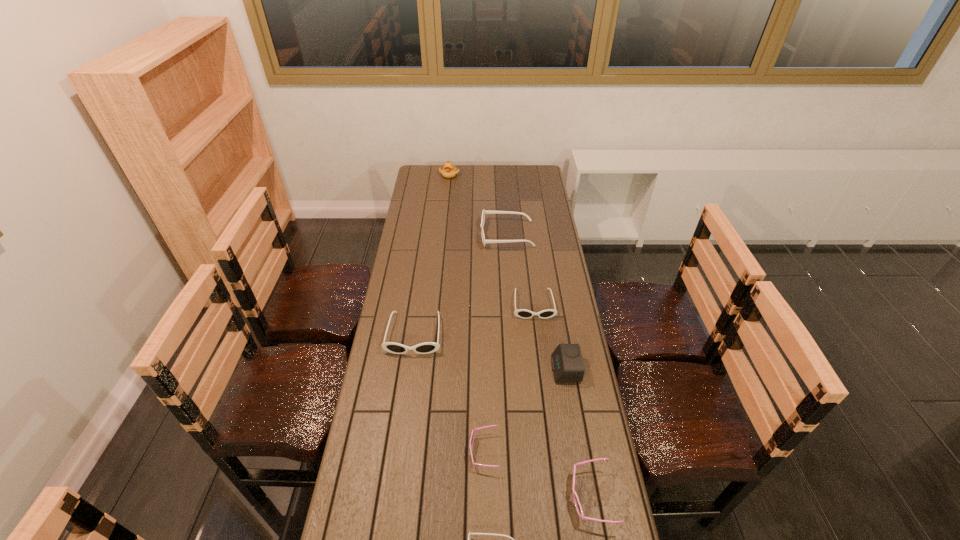
Where is `free point between the black alarm clock and the bigger pink sunglasses`? This screenshot has width=960, height=540. free point between the black alarm clock and the bigger pink sunglasses is located at coordinates (578, 433).

The height and width of the screenshot is (540, 960). Find the location of `object that is the fifth closest to the nearest object`. object that is the fifth closest to the nearest object is located at coordinates (521, 313).

You are a GUI agent. You are given a task and a screenshot of the screen. Output one action in this format:
    pyautogui.click(x=<x>, y=<y>)
    Task: Click on the object that stands as the sixth closest to the second smallest black sunglasses
    
    Given the screenshot: What is the action you would take?
    pyautogui.click(x=470, y=534)

Find the location of `sunglasses identified as the closest to the nearest black sunglasses`. sunglasses identified as the closest to the nearest black sunglasses is located at coordinates pos(577,504).

Identify which sunglasses is the nearest to the leftmost black sunglasses. Please provide its 2D coordinates. Your answer should be formatted as a tuple, i.e. [(x, y)], where the tuple contains the x and y coordinates of a point satisfying the conditions above.

[(521, 313)]

Where is `the closest black sunglasses to the nearest sunglasses`? the closest black sunglasses to the nearest sunglasses is located at coordinates (428, 347).

This screenshot has height=540, width=960. I want to click on the fourth closest black sunglasses relative to the duckling, so click(470, 534).